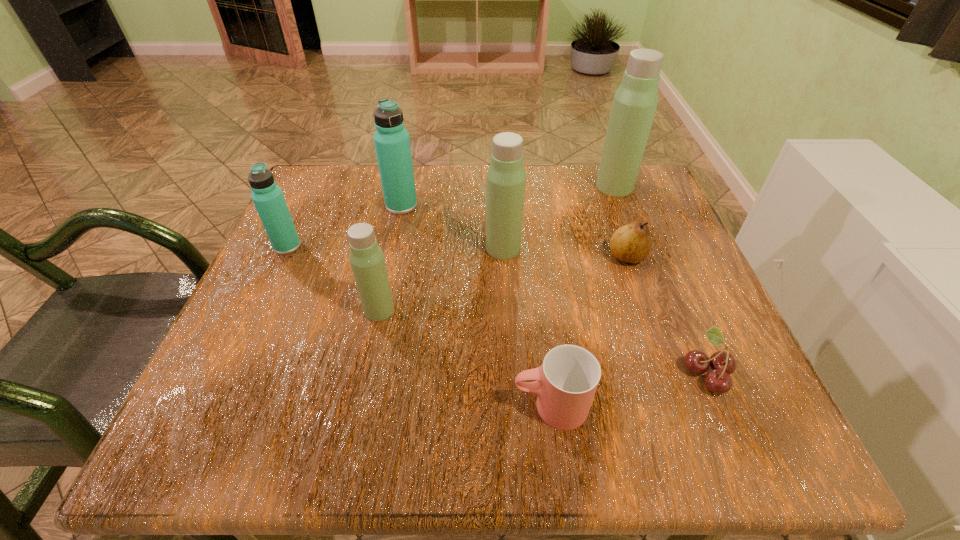
I want to click on pear at the right edge, so click(631, 243).

Find the location of `cherry that is at the right edge`. cherry that is at the right edge is located at coordinates (718, 380).

You are a GUI agent. You are given a task and a screenshot of the screen. Output one action in this format:
    pyautogui.click(x=<x>, y=<y>)
    Task: Click on the object present at the far right corner
    
    Given the screenshot: What is the action you would take?
    pyautogui.click(x=634, y=105)

Image resolution: width=960 pixels, height=540 pixels. Identify the location of object at the near right corner. pos(718,380).

You are a GUI agent. You are given a task and a screenshot of the screen. Output one action in this format:
    pyautogui.click(x=<x>, y=<y>)
    Task: Click on the vacant space at the far edge of the desktop
    The image size is (960, 540).
    Given the screenshot: What is the action you would take?
    pyautogui.click(x=551, y=214)

Find the location of `vacant space at the near edge of the desktop`. vacant space at the near edge of the desktop is located at coordinates (498, 400).

In the image, there is a desktop. Where is `blank space at the left edge`? blank space at the left edge is located at coordinates (282, 261).

Where is `free point at the right edge`? free point at the right edge is located at coordinates (649, 271).

Where is `vacant space at the far left corner of the desktop`? vacant space at the far left corner of the desktop is located at coordinates (334, 220).

Where is `blank space at the near left corner of the desktop`? This screenshot has height=540, width=960. blank space at the near left corner of the desktop is located at coordinates (244, 453).